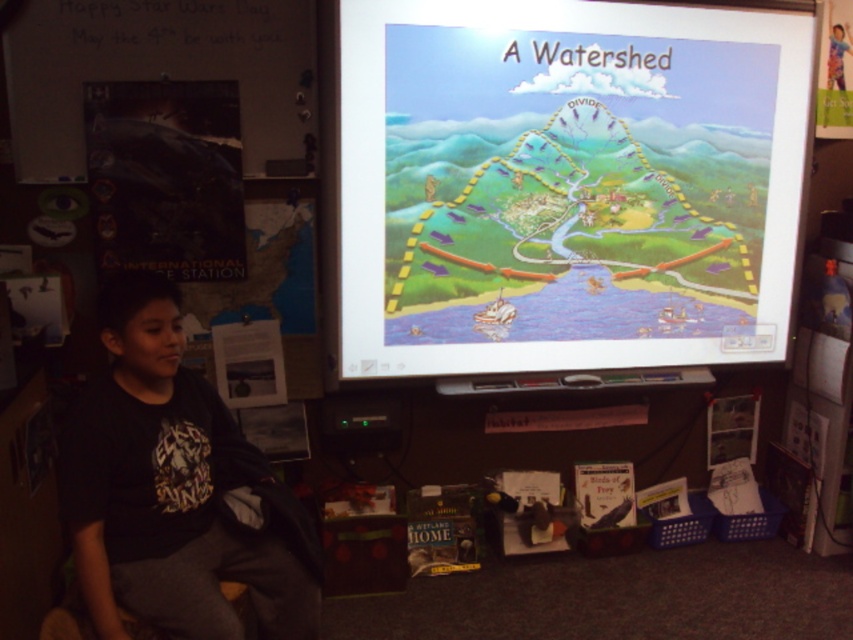
Question: Which point is farther to the camera?

Choices:
 (A) black cotton shirt at lower left
 (B) cartoon map at upper center

Answer: (B)

Question: Does cartoon map at upper center have a larger size compared to black cotton shirt at lower left?

Choices:
 (A) yes
 (B) no

Answer: (A)

Question: Is the position of cartoon map at upper center less distant than that of black cotton shirt at lower left?

Choices:
 (A) no
 (B) yes

Answer: (A)

Question: Can you confirm if cartoon map at upper center is bigger than black cotton shirt at lower left?

Choices:
 (A) no
 (B) yes

Answer: (B)